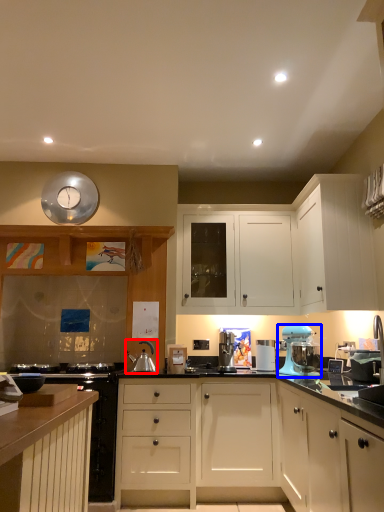
Question: Which point is closer to the camera, appliance (highlighted by a red box) or home appliance (highlighted by a blue box)?

Choices:
 (A) appliance
 (B) home appliance

Answer: (B)